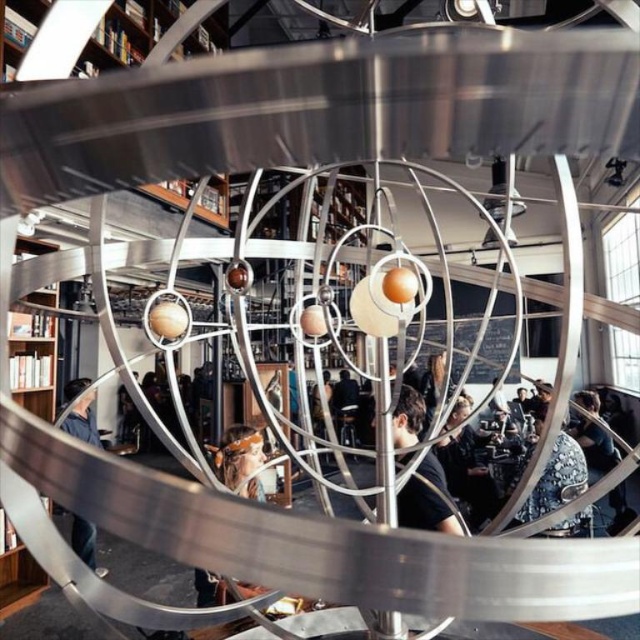
Can you confirm if brown wooden bookshelf at left is shorter than brown leather jacket at center?

No, brown wooden bookshelf at left is not shorter than brown leather jacket at center.

Measure the distance between brown wooden bookshelf at left and camera.

brown wooden bookshelf at left is 14.59 feet from camera.

Which is behind, point (24, 237) or point (228, 454)?

Point (24, 237)

The width and height of the screenshot is (640, 640). Identify the location of brown wooden bookshelf at left. (33, 358).

Who is more distant from viewer, (416, 484) or (81, 529)?

The point (81, 529) is behind.

Does matte black shirt at center have a lesser height compared to denim jacket at lower left?

No.

At what (x,y) coordinates should I click in order to perform the action: click on matte black shirt at center. Please return your answer as a coordinate pair (x, y). This screenshot has width=640, height=640. Looking at the image, I should click on (424, 509).

Identify the location of matte black shirt at center. This screenshot has height=640, width=640. (424, 509).

Between brown wooden bookshelf at left and denim jacket at lower left, which one has more height?

With more height is brown wooden bookshelf at left.

The image size is (640, 640). What do you see at coordinates (33, 358) in the screenshot? I see `brown wooden bookshelf at left` at bounding box center [33, 358].

Locate an element on the screen. The width and height of the screenshot is (640, 640). brown wooden bookshelf at left is located at coordinates (33, 358).